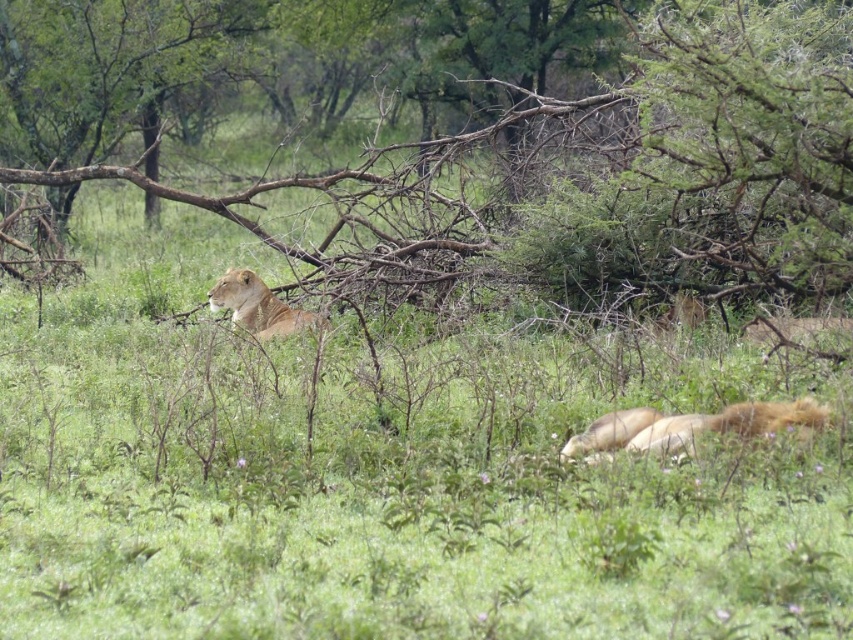
Question: In this image, where is golden fur lion at lower right located relative to golden fur lioness at upper left?

Choices:
 (A) left
 (B) right

Answer: (B)

Question: From the image, what is the correct spatial relationship of brown wood tree at upper center in relation to golden fur lion at lower right?

Choices:
 (A) right
 (B) left

Answer: (B)

Question: Which object is positioned farthest from the brown wood tree at upper center?

Choices:
 (A) golden fur lioness at upper left
 (B) golden fur lion at lower right

Answer: (B)

Question: Where is golden fur lion at lower right located in relation to golden fur lioness at upper left in the image?

Choices:
 (A) left
 (B) right

Answer: (B)

Question: Among these points, which one is nearest to the camera?

Choices:
 (A) (647, 412)
 (B) (236, 305)

Answer: (A)

Question: Which of the following is the closest to the observer?

Choices:
 (A) (695, 154)
 (B) (810, 420)
 (C) (276, 316)

Answer: (B)